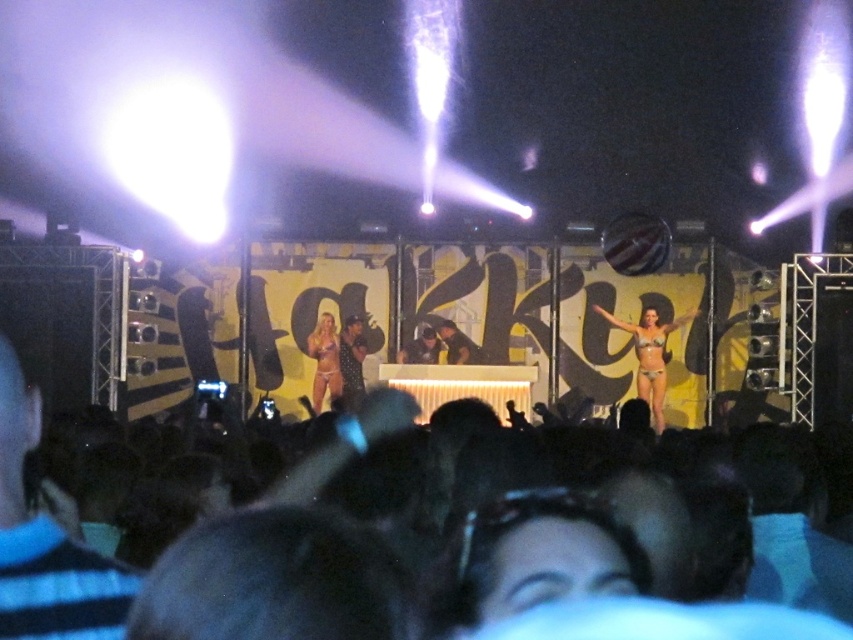
From the picture: Does black hair at lower center have a smaller size compared to matte bikini at center?

Indeed, black hair at lower center has a smaller size compared to matte bikini at center.

Does black hair at lower center appear under matte bikini at center?

Yes, black hair at lower center is below matte bikini at center.

What do you see at coordinates (198, 570) in the screenshot? I see `black hair at lower center` at bounding box center [198, 570].

The height and width of the screenshot is (640, 853). Find the location of `black hair at lower center`. black hair at lower center is located at coordinates (198, 570).

Is point (86, 609) less distant than point (322, 392)?

Yes, point (86, 609) is closer to viewer.

Who is lower down, black hair at lower center or matte purple bikini at center?

black hair at lower center is lower down.

Between point (77, 598) and point (318, 365), which one is positioned in front?

Point (77, 598)

Locate an element on the screen. black hair at lower center is located at coordinates (198, 570).

Can you confirm if matte black sunglasses at center is positioned to the right of matte purple bikini at center?

Correct, you'll find matte black sunglasses at center to the right of matte purple bikini at center.

Can you confirm if matte black sunglasses at center is thinner than matte purple bikini at center?

No, matte black sunglasses at center is not thinner than matte purple bikini at center.

Which is behind, point (485, 547) or point (334, 364)?

Point (334, 364)

You are a GUI agent. You are given a task and a screenshot of the screen. Output one action in this format:
    pyautogui.click(x=<x>, y=<y>)
    Task: Click on the matte black sunglasses at center
    
    Given the screenshot: What is the action you would take?
    pyautogui.click(x=535, y=557)